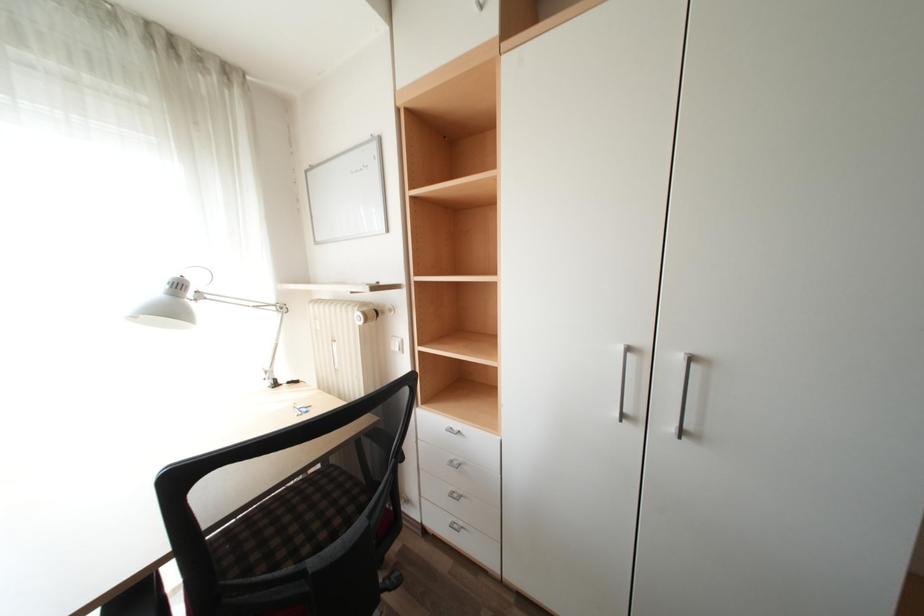
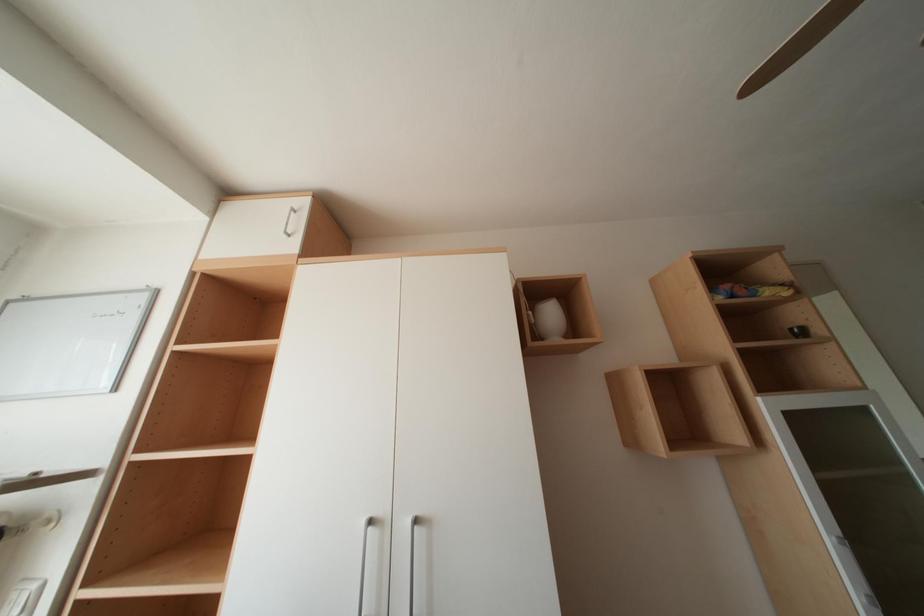
First-person continuous shooting, in which direction is the camera rotating?

The camera rotated toward right-up.